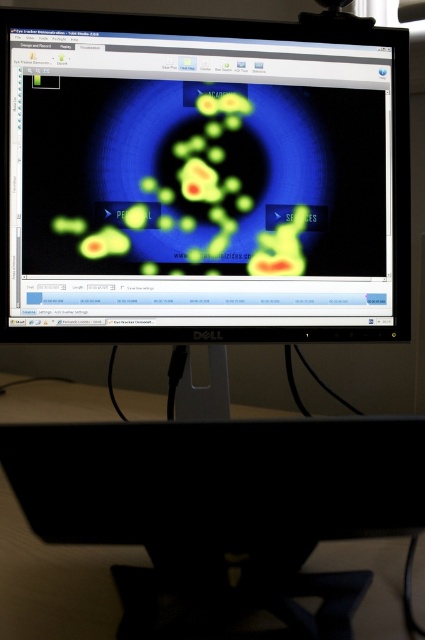
Between point (227, 125) and point (422, 600), which one is positioned in front?

Point (422, 600) is more forward.

Find the location of `matte plastic monitor at center`. matte plastic monitor at center is located at coordinates (203, 179).